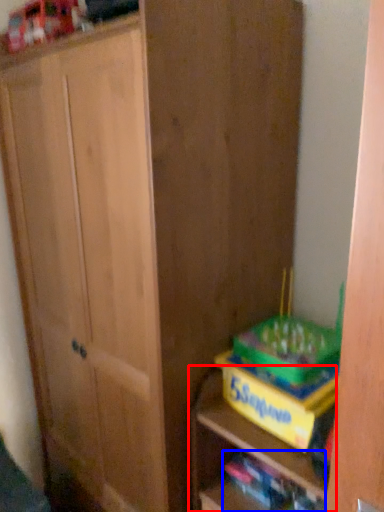
Question: Which of the following is the closest to the observer, shelf (highlighted by a red box) or book (highlighted by a blue box)?

Choices:
 (A) shelf
 (B) book

Answer: (A)